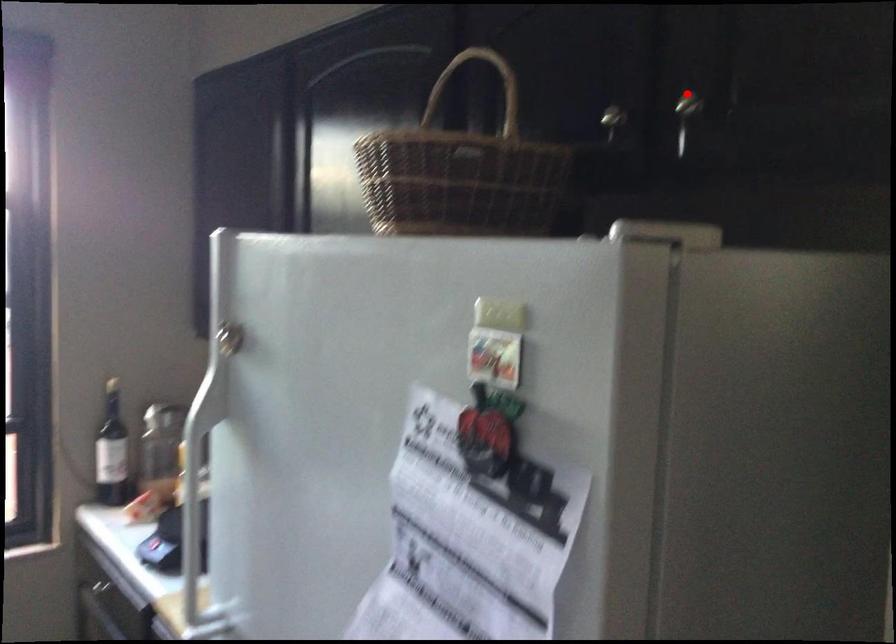
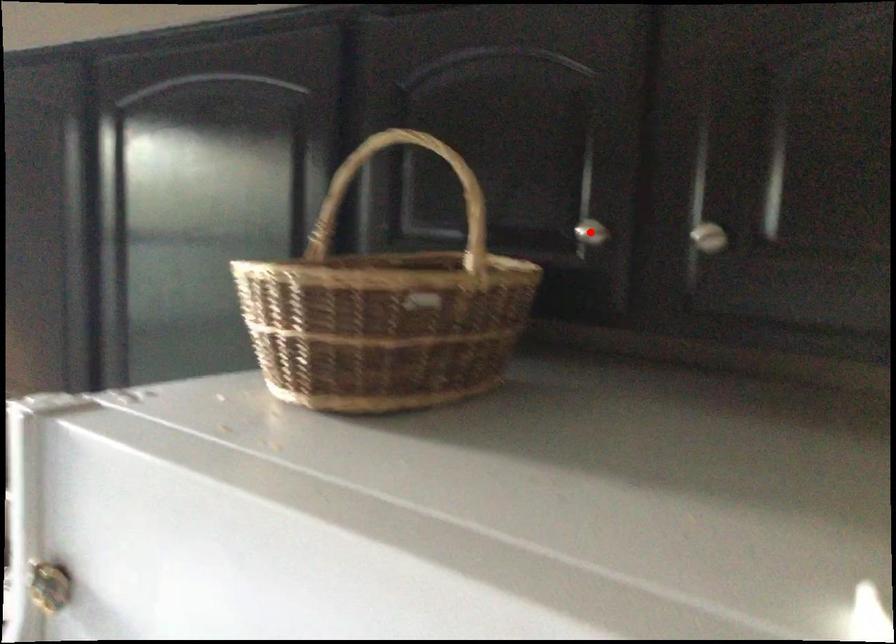
I am providing you with two images of the same scene from different viewpoints. A red point is marked on the first image and another point is marked on the second image. Is the red point in image1 aligned with the point shown in image2?

No